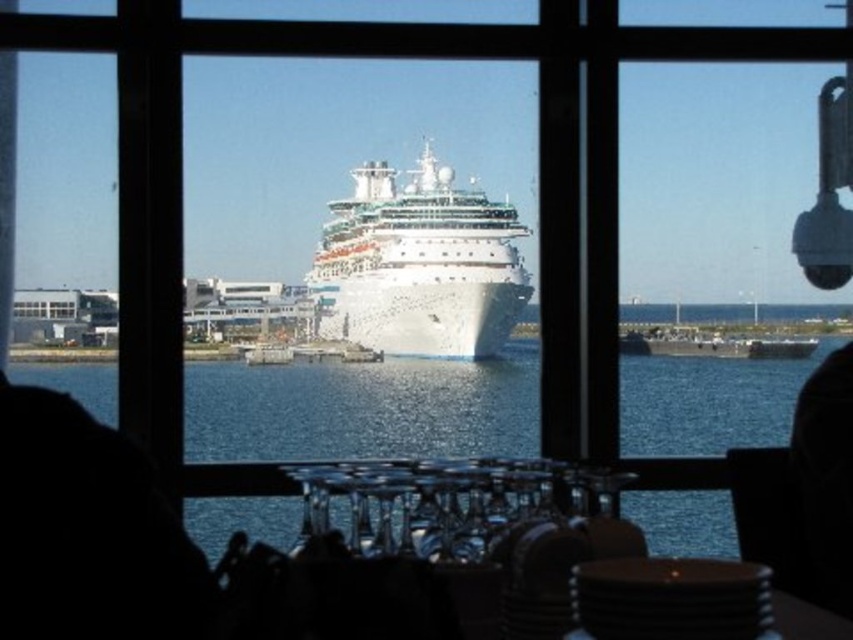
Question: From the image, what is the correct spatial relationship of blue water at center in relation to white glossy cruise ship at center?

Choices:
 (A) right
 (B) left

Answer: (A)

Question: Can you confirm if blue water at center is positioned above white glossy cruise ship at center?

Choices:
 (A) no
 (B) yes

Answer: (A)

Question: Where is blue water at center located in relation to white glossy cruise ship at center in the image?

Choices:
 (A) right
 (B) left

Answer: (A)